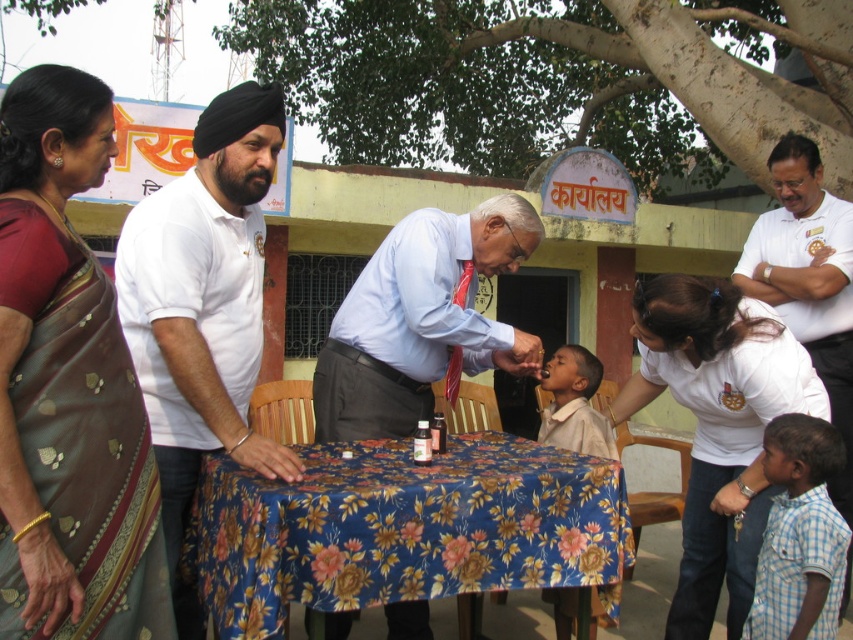
Does point (770, 444) come farther from viewer compared to point (572, 356)?

No, it is in front of (572, 356).

Which is more to the left, blue checkered shirt at lower right or light brown cotton shirt at center?

Positioned to the left is light brown cotton shirt at center.

Where is `blue checkered shirt at lower right`? This screenshot has height=640, width=853. blue checkered shirt at lower right is located at coordinates (799, 534).

Between white shirt at right and light brown cotton shirt at center, which one has less height?

light brown cotton shirt at center is shorter.

Who is positioned more to the left, white shirt at right or light brown cotton shirt at center?

light brown cotton shirt at center

Locate an element on the screen. This screenshot has width=853, height=640. white shirt at right is located at coordinates (808, 280).

Is white cotton shirt at left shorter than light brown cotton shirt at center?

No, white cotton shirt at left is not shorter than light brown cotton shirt at center.

Is white cotton shirt at left wider than light brown cotton shirt at center?

Correct, the width of white cotton shirt at left exceeds that of light brown cotton shirt at center.

You are a GUI agent. You are given a task and a screenshot of the screen. Output one action in this format:
    pyautogui.click(x=<x>, y=<y>)
    Task: Click on the white cotton shirt at left
    This screenshot has width=853, height=640.
    Given the screenshot: What is the action you would take?
    pyautogui.click(x=202, y=308)